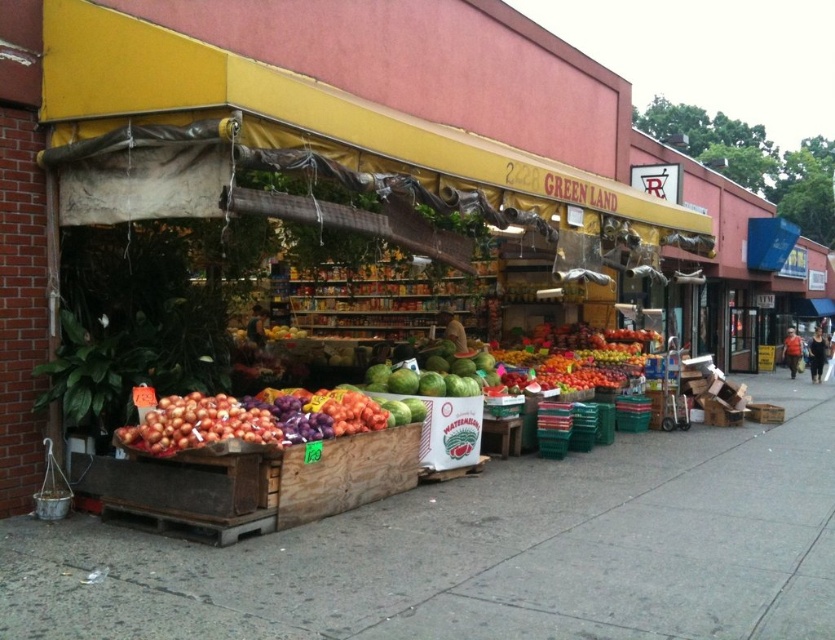
Does shiny red apples at center have a lesser width compared to shiny brown onions at lower left?

No, shiny red apples at center is not thinner than shiny brown onions at lower left.

Who is more distant from viewer, (560, 358) or (225, 435)?

Positioned behind is point (560, 358).

Where is `shiny red apples at center`? shiny red apples at center is located at coordinates (578, 355).

I want to click on shiny red apples at center, so click(x=578, y=355).

The image size is (835, 640). Describe the element at coordinates (486, 552) in the screenshot. I see `wooden crates at center` at that location.

Does wooden crates at center have a greater width compared to shiny brown onions at lower left?

Yes.

Where is `wooden crates at center`? Image resolution: width=835 pixels, height=640 pixels. wooden crates at center is located at coordinates (486, 552).

You are a GUI agent. You are given a task and a screenshot of the screen. Output one action in this format:
    pyautogui.click(x=<x>, y=<y>)
    Task: Click on the wooden crates at center
    The image size is (835, 640).
    Given the screenshot: What is the action you would take?
    pyautogui.click(x=486, y=552)

Is wooden crates at center behind shiny red apples at center?

No, wooden crates at center is in front of shiny red apples at center.

Does wooden crates at center have a lesser width compared to shiny red apples at center?

No, wooden crates at center is not thinner than shiny red apples at center.

Who is more distant from viewer, (763, 452) or (608, 349)?

The point (608, 349) is more distant.

This screenshot has height=640, width=835. In order to click on wooden crates at center in this screenshot , I will do `click(486, 552)`.